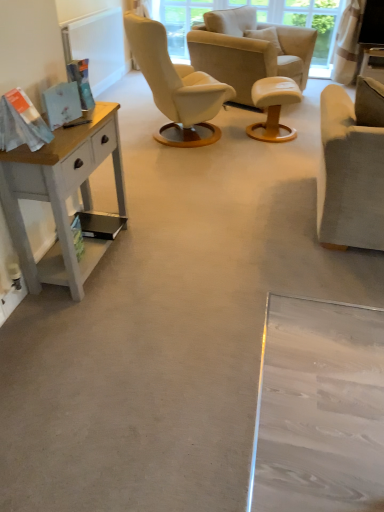
At what (x,y) coordinates should I click in order to perform the action: click on blank area to the left of suede beige armchair at right, the first chair viewed from the front. Please return your answer as a coordinate pair (x, y). Looking at the image, I should click on (271, 220).